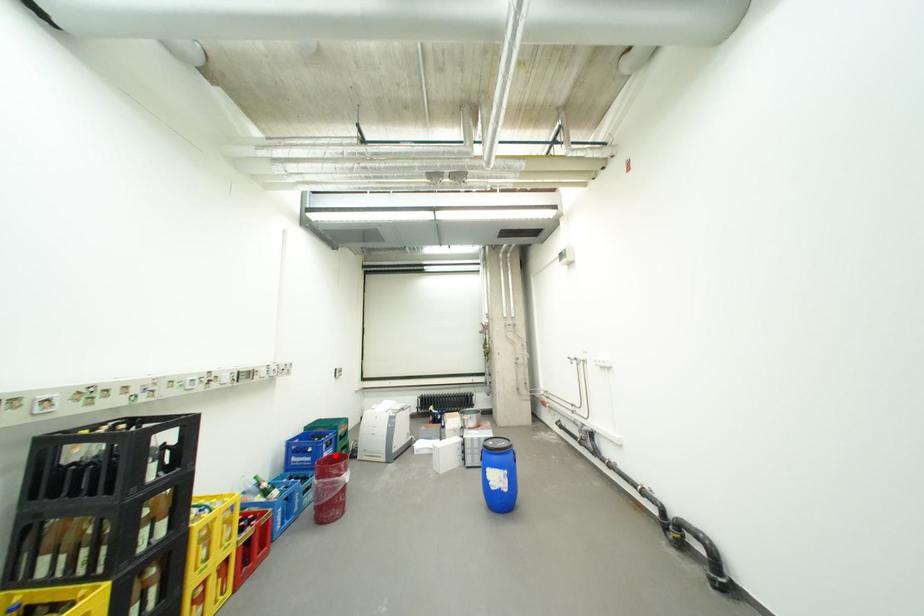
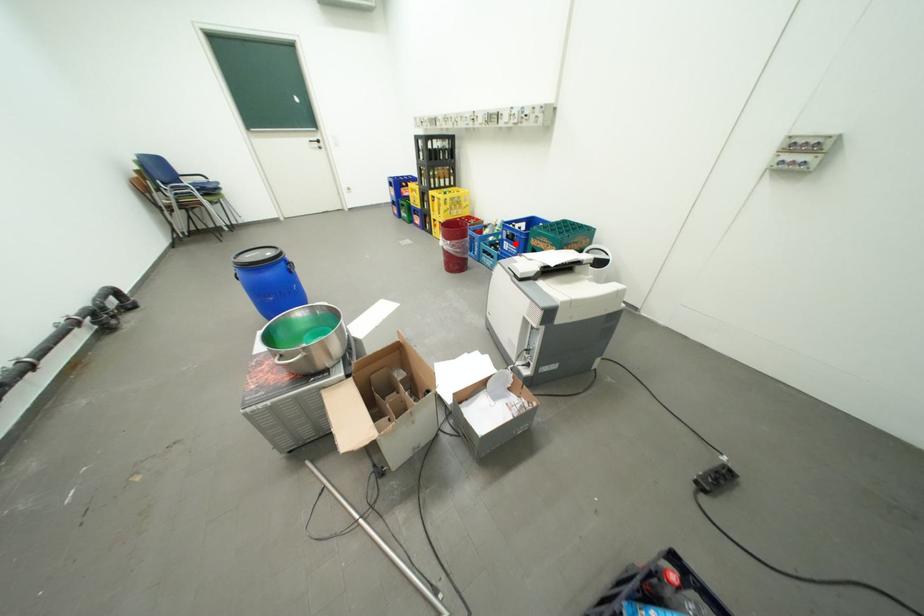
I am providing you with two images of the same scene from different viewpoints. A red point is marked on the first image and another point is marked on the second image. Is the red point in image1 aligned with the point shown in image2?

Yes